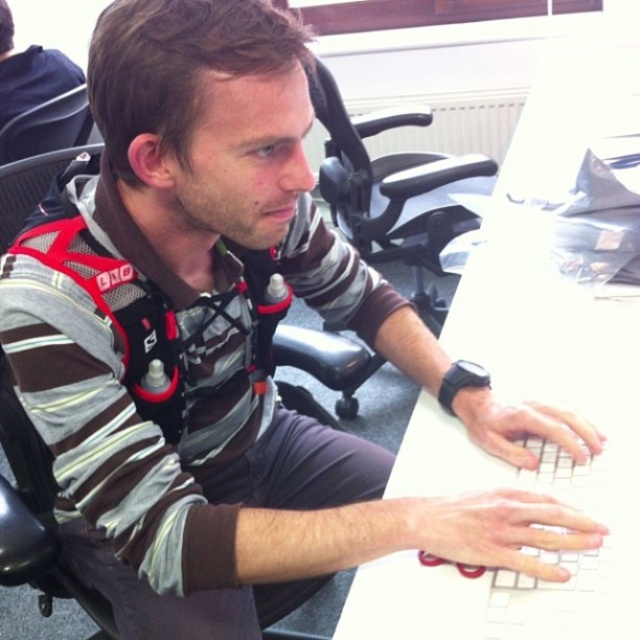
You are standing in an office and want to sit down quickly. Which chair would you reach first, the black plastic chair at center or the black plastic swivel chair at center?

The black plastic chair at center is closer to the viewer, so you would reach it first before the black plastic swivel chair at center.

Looking at this image, you are a photographer taking a picture of the scene. You notice two points in the image at coordinates point (108,620) and point (308,67). Which point will appear closer to the camera in the photo?

Point (308,67) will appear closer to the camera because it is closer to the photographer than point (108,620), which is further away.

You are standing at the entrance of the office and want to sit down on the black plastic chair at center. Based on its position, can you estimate whether you need to walk forward or backward to reach it?

The black plastic chair at center is located at point (33, 536), which is closer to the front of the image. Since you are at the entrance, you would likely need to walk forward to reach it.